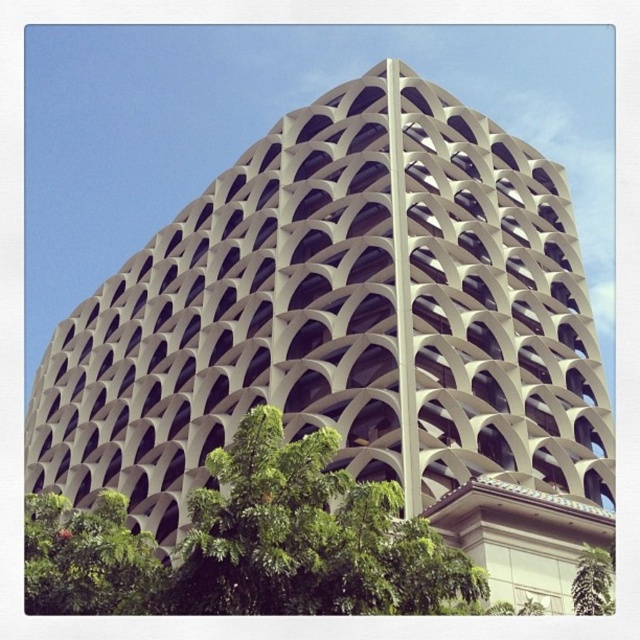
You are standing in front of the architectural structure and want to take a photo. You notice two points on the building. One is at coordinate point (60,557) and the other is at point (580,612). Which point is closer to your camera?

Point (60,557) is closer to the camera than point (580,612).

You are standing at the base of the building and want to take a photo of the point at coordinates point (29, 540). Given that your camera can focus on objects up to 35 meters away, will you be able to capture this point clearly?

The distance of point (29, 540) from the camera is 34.68 meters, which is within the camera focus range of 35 meters. Therefore, you can capture the point clearly.

You are standing in front of the building and want to take a photo that includes both the green leafy tree at lower left and the central arch of the building. Given that the central arch is located at the center of the image, can you fit both elements in your camera frame if your camera has a standard 50mm lens with a 46 degree angle of view?

The green leafy tree at lower left is at point (86, 557), which is far from the central arch. With a 46 degree angle of view, the camera can capture both elements as they are positioned within the frame.